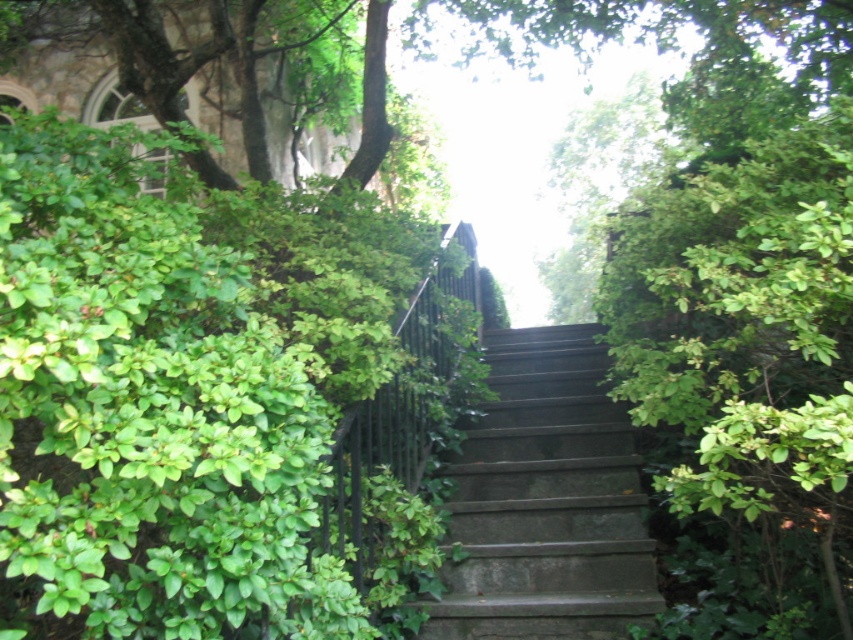
Does dark gray stone stairs at center have a lesser width compared to green leafy tree at upper center?

No, dark gray stone stairs at center is not thinner than green leafy tree at upper center.

Does dark gray stone stairs at center have a lesser height compared to green leafy tree at upper center?

No.

Describe the element at coordinates (546, 500) in the screenshot. I see `dark gray stone stairs at center` at that location.

Locate an element on the screen. This screenshot has height=640, width=853. dark gray stone stairs at center is located at coordinates (546, 500).

The height and width of the screenshot is (640, 853). Describe the element at coordinates (213, 401) in the screenshot. I see `green leafy bush at left` at that location.

Which is above, green leafy bush at left or green leafy tree at upper center?

green leafy tree at upper center is higher up.

Locate an element on the screen. The height and width of the screenshot is (640, 853). green leafy bush at left is located at coordinates (213, 401).

In order to click on green leafy bush at left in this screenshot , I will do `click(213, 401)`.

Who is lower down, green leafy bush at left or dark gray stone stairs at center?

dark gray stone stairs at center is lower down.

Locate an element on the screen. Image resolution: width=853 pixels, height=640 pixels. green leafy bush at left is located at coordinates (213, 401).

The image size is (853, 640). Find the location of `green leafy bush at left`. green leafy bush at left is located at coordinates (213, 401).